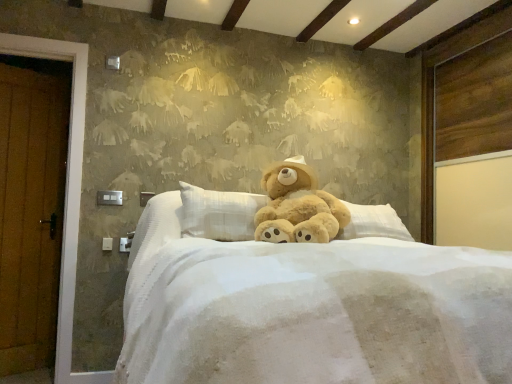
Question: From a real-world perspective, is soft white fabric bed at center positioned above or below fuzzy beige teddy bear at center?

Choices:
 (A) above
 (B) below

Answer: (B)

Question: In terms of size, does soft white fabric bed at center appear bigger or smaller than fuzzy beige teddy bear at center?

Choices:
 (A) small
 (B) big

Answer: (B)

Question: Considering the positions of soft white fabric bed at center and fuzzy beige teddy bear at center in the image, is soft white fabric bed at center taller or shorter than fuzzy beige teddy bear at center?

Choices:
 (A) tall
 (B) short

Answer: (A)

Question: Based on their positions, is fuzzy beige teddy bear at center located to the left or right of soft white fabric bed at center?

Choices:
 (A) left
 (B) right

Answer: (A)

Question: From a real-world perspective, is fuzzy beige teddy bear at center physically located above or below soft white fabric bed at center?

Choices:
 (A) below
 (B) above

Answer: (B)

Question: Is fuzzy beige teddy bear at center inside or outside of soft white fabric bed at center?

Choices:
 (A) inside
 (B) outside

Answer: (A)

Question: From the image's perspective, is fuzzy beige teddy bear at center above or below soft white fabric bed at center?

Choices:
 (A) below
 (B) above

Answer: (B)